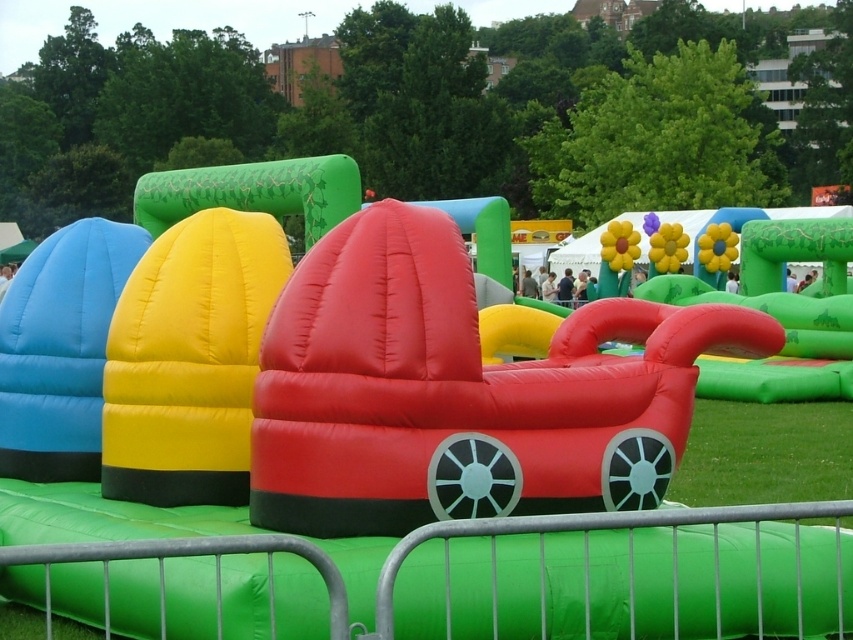
Question: Can you confirm if rubberized red car at center is wider than green grass at lower right?

Choices:
 (A) no
 (B) yes

Answer: (A)

Question: Is rubberized red car at center bigger than green grass at lower right?

Choices:
 (A) no
 (B) yes

Answer: (A)

Question: Does rubberized red car at center appear on the right side of green grass at lower right?

Choices:
 (A) yes
 (B) no

Answer: (B)

Question: Which point appears farthest from the camera in this image?

Choices:
 (A) (763, 481)
 (B) (502, 492)

Answer: (A)